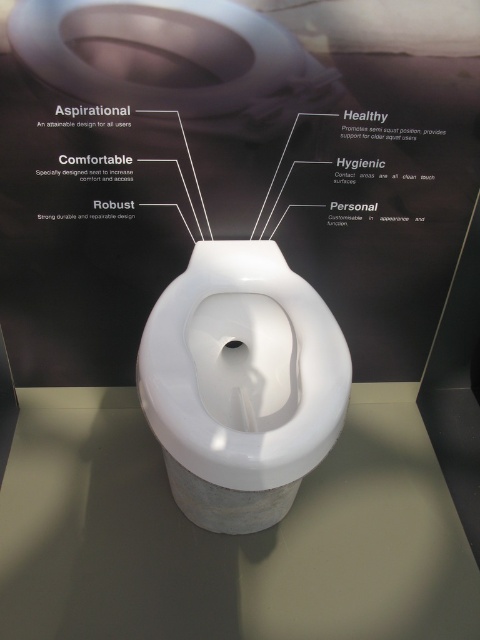
Is point (330, 611) less distant than point (91, 48)?

No, it is behind (91, 48).

Does transparent glass table at center have a lesser height compared to matte white toilet lid at upper center?

Incorrect, transparent glass table at center's height does not fall short of matte white toilet lid at upper center's.

The height and width of the screenshot is (640, 480). What do you see at coordinates (227, 536) in the screenshot? I see `transparent glass table at center` at bounding box center [227, 536].

The width and height of the screenshot is (480, 640). I want to click on transparent glass table at center, so click(x=227, y=536).

Can you confirm if white glossy toilet at center is positioned above white plastic toilet at center?

Actually, white glossy toilet at center is below white plastic toilet at center.

Does white glossy toilet at center have a greater width compared to white plastic toilet at center?

Yes.

The width and height of the screenshot is (480, 640). What are the coordinates of `white glossy toilet at center` in the screenshot? It's located at (230, 164).

Is white glossy toilet bowl at center to the left of matte white toilet lid at upper center from the viewer's perspective?

No, white glossy toilet bowl at center is not to the left of matte white toilet lid at upper center.

Does white glossy toilet bowl at center come behind matte white toilet lid at upper center?

That is False.

Image resolution: width=480 pixels, height=640 pixels. In order to click on white glossy toilet bowl at center in this screenshot , I will do `click(241, 384)`.